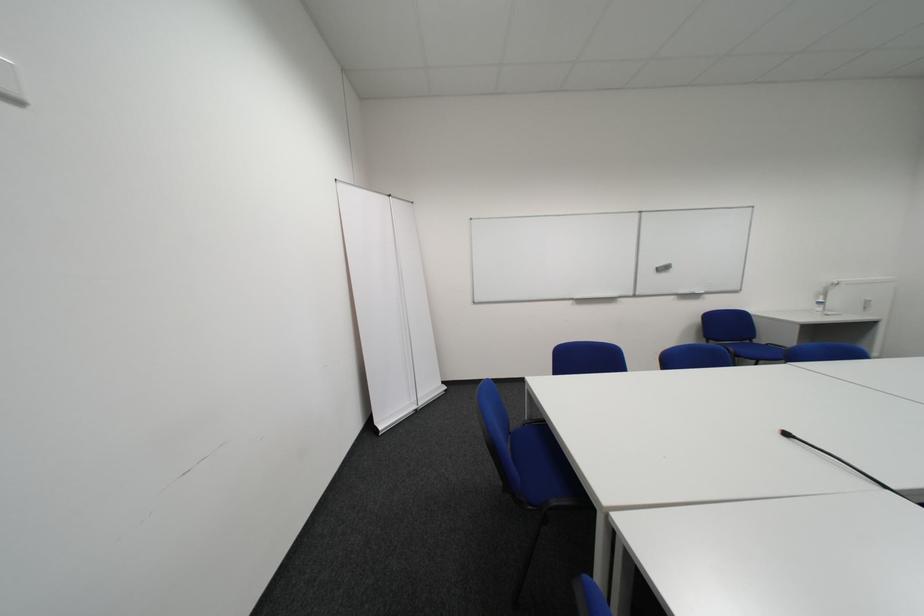
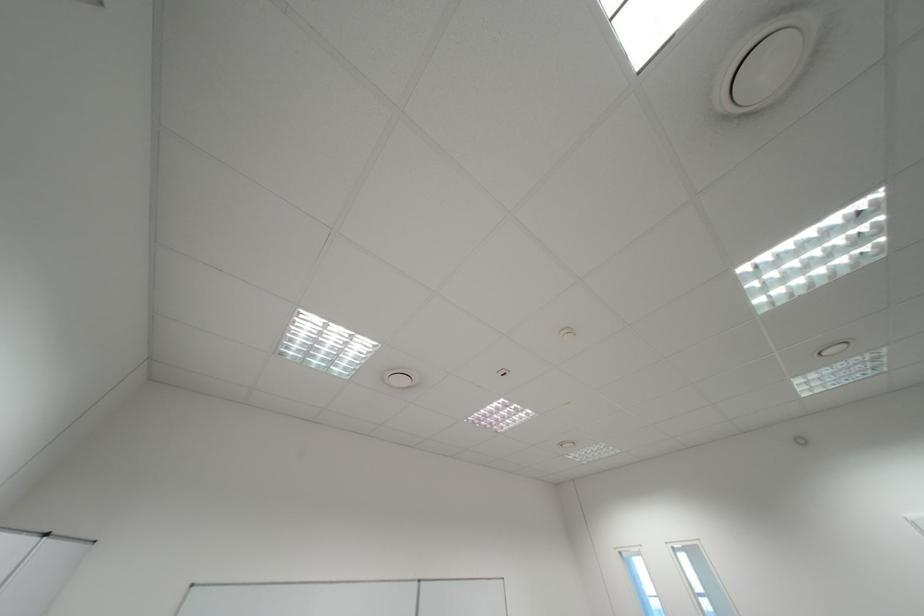
First-person continuous shooting, in which direction is the camera rotating?

The camera's rotation is toward right-up.